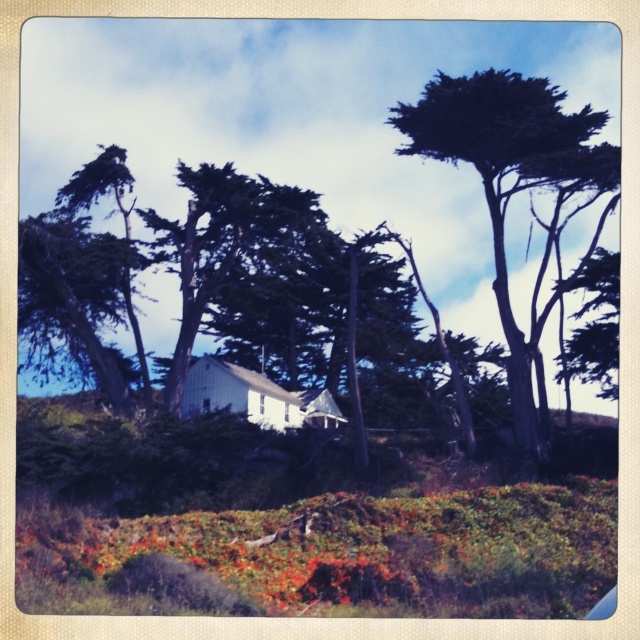
Based on the photo, measure the distance between green leafy bush at lower center and dark green textured tree at upper right.

The distance of green leafy bush at lower center from dark green textured tree at upper right is 38.14 meters.

Which is behind, point (84, 557) or point (525, 412)?

The point (525, 412) is more distant.

Find the location of a particular element. The width and height of the screenshot is (640, 640). green leafy bush at lower center is located at coordinates (332, 556).